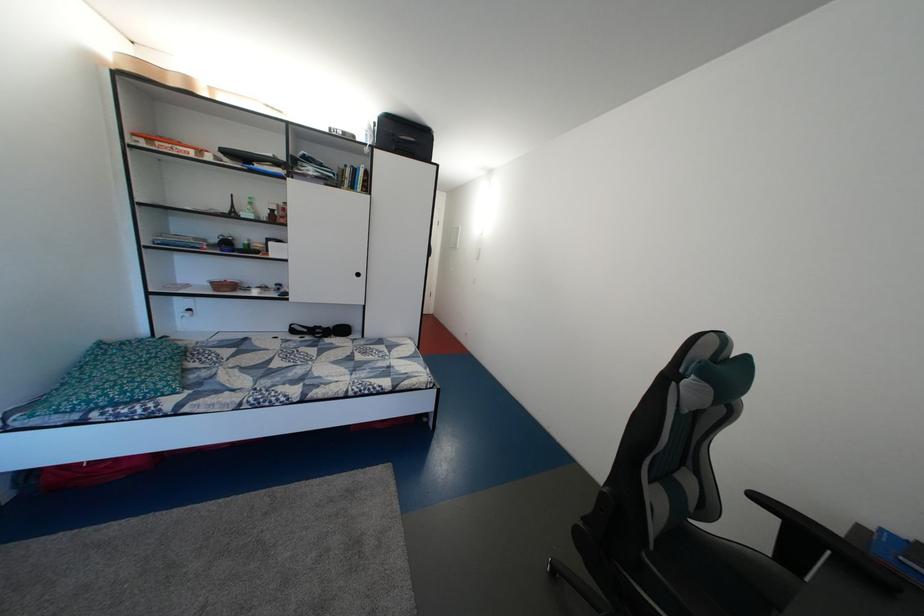
Where is `green patterned pillow`? The width and height of the screenshot is (924, 616). green patterned pillow is located at coordinates (115, 377).